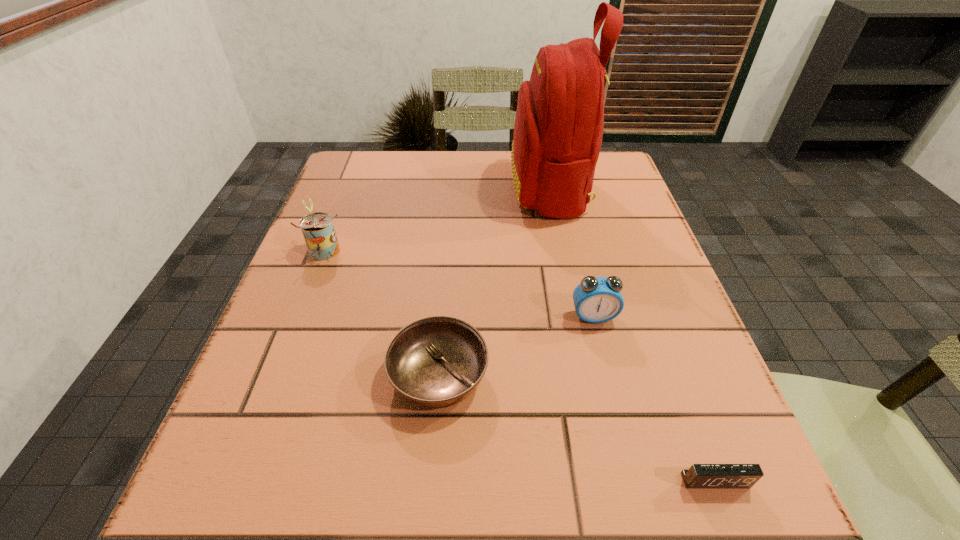
Image resolution: width=960 pixels, height=540 pixels. Identify the location of object that is the second closest to the shorter alarm clock. (434, 362).

Identify the location of vacant position in the image that satisfies the following two spatial constraints: 1. on the front side of the leftmost object; 2. on the right side of the fourth tallest object. This screenshot has width=960, height=540. (273, 375).